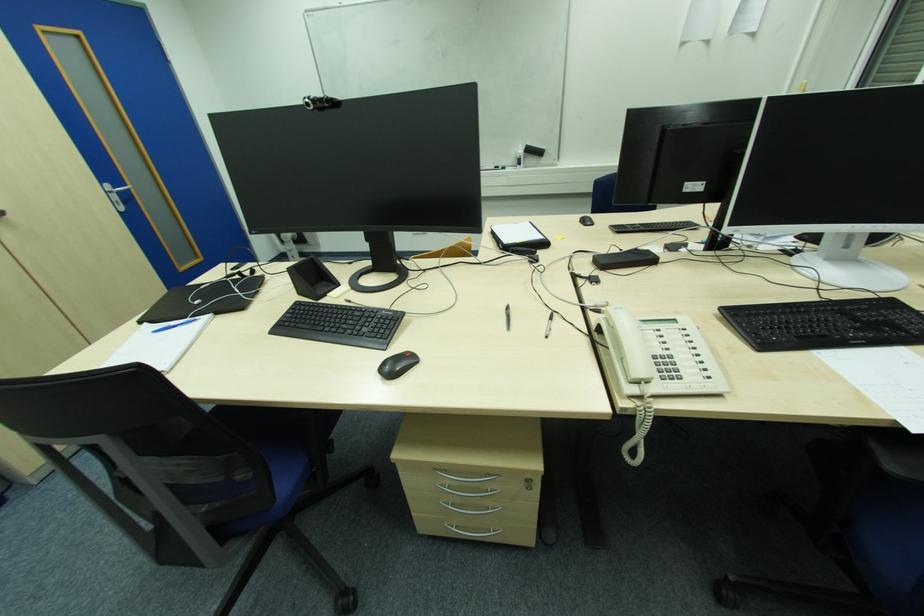
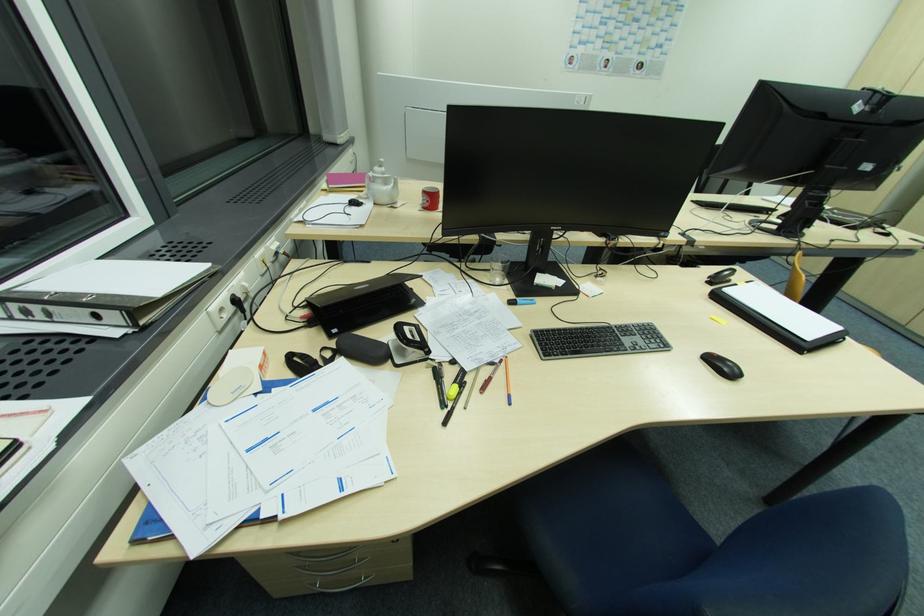
Question: I am providing you with two images of the same scene from different viewpoints. Which of the following objects are not visible in image2?

Choices:
 (A) red dolly handle
 (B) binder ring lever
 (C) red mug
 (D) blue pen

Answer: (D)